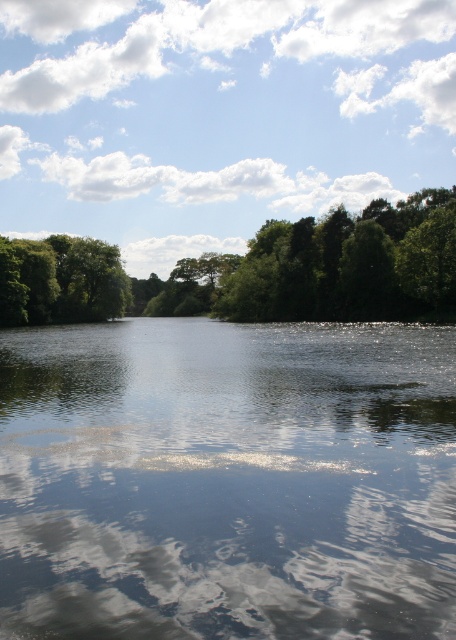
You are standing at the origin point of the coordinate system. You want to place a small boat in the transparent water at center. What are the coordinates where you should place the boat?

The transparent water at center is located at coordinates point (228, 481), so you should place the boat at those coordinates.

You are an artist painting this landscape and want to ensure the white fluffy cloud at upper center and the green leafy trees at upper center are arranged correctly. According to the scene, which object should be placed higher in your painting?

The white fluffy cloud at upper center should be placed higher than the green leafy trees at upper center because it is positioned over them.

You are a photographer standing at the edge of the transparent water at center. You notice the white fluffy cloud at upper center in the sky. Which object is taller from your perspective?

The white fluffy cloud at upper center is taller than the transparent water at center from your perspective.